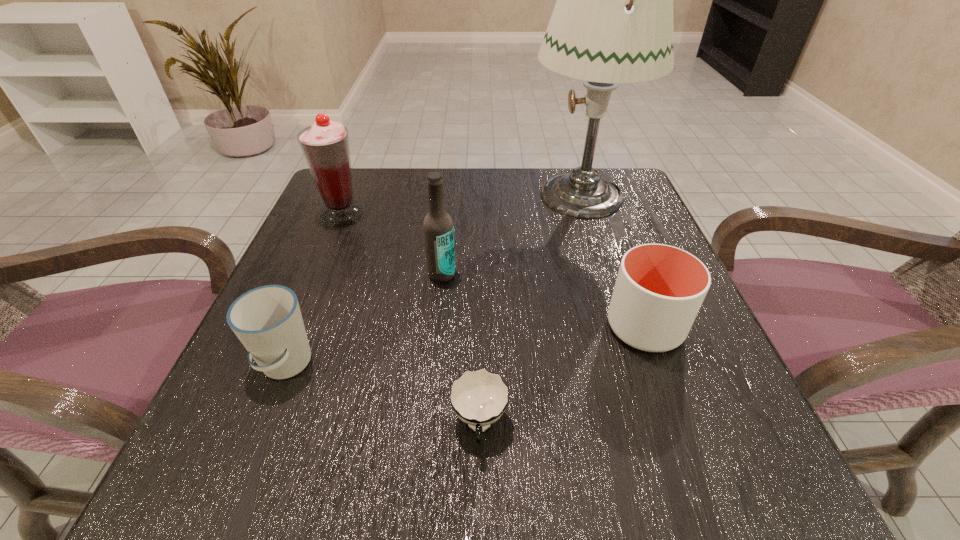
Find the location of a particular element. Image resolution: width=960 pixels, height=540 pixels. the tallest object is located at coordinates (x=612, y=23).

The image size is (960, 540). What are the coordinates of `smoothie` in the screenshot? It's located at (325, 145).

At what (x,y) coordinates should I click in order to perform the action: click on the third object from left to right. Please return your answer as a coordinate pair (x, y). The image size is (960, 540). Looking at the image, I should click on (438, 228).

Identify the location of beer bottle. This screenshot has width=960, height=540. (438, 228).

Find the location of a particular element. the rightmost cup is located at coordinates (659, 289).

The image size is (960, 540). In order to click on the leftmost cup in this screenshot , I will do `click(267, 320)`.

At what (x,y) coordinates should I click in order to perform the action: click on the shortest object. Please return your answer as a coordinate pair (x, y). This screenshot has width=960, height=540. Looking at the image, I should click on (479, 397).

The width and height of the screenshot is (960, 540). What are the coordinates of `the second cup from left to right` in the screenshot? It's located at (479, 397).

Identify the location of blank space located 0.400m on the lampshade of the lampshade. The image size is (960, 540). (356, 194).

This screenshot has width=960, height=540. Identify the location of free spot located on the lampshade of the lampshade. (489, 194).